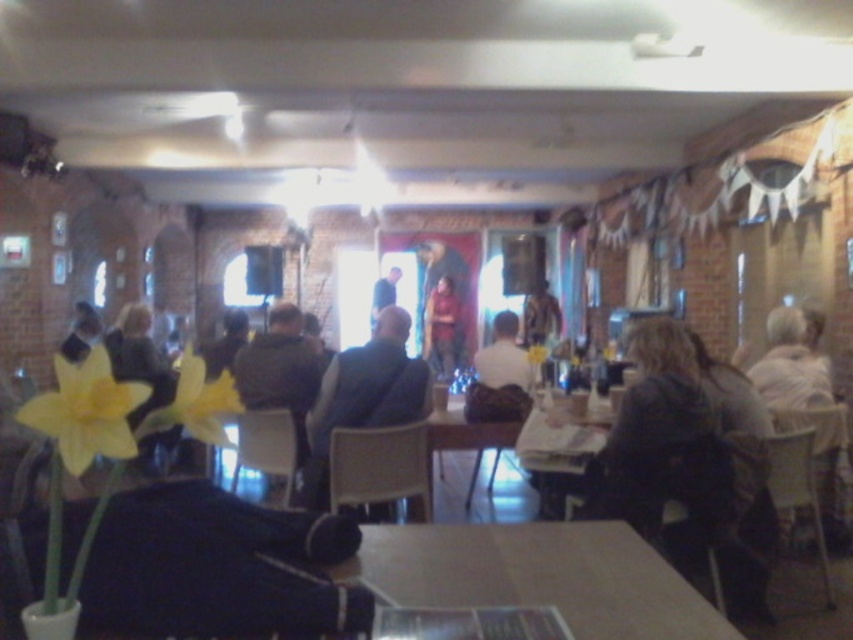
You are planning to place a new decorative item on the table where the yellow matte flower at lower left and the matte red shirt at center are located. Considering their current sizes, which object would allow more space for the new item?

The yellow matte flower at lower left occupies less space than the matte red shirt at center, so placing the new item near the yellow matte flower at lower left would leave more space available.

You are standing in the community hall and want to reach the matte red shirt at center without stepping on the yellow matte flower at lower left. Is this possible?

The yellow matte flower at lower left is closer to the viewer than the matte red shirt at center, so you can walk around it to reach the matte red shirt at center without stepping on the flower.

Looking at this image, you are organizing a coat check for an event and have a small hook that can only hold items up to 20 inches wide. You need to hang both the dark blue vest at center and the dark brown leather jacket at center. Which item is more likely to fit on the hook based on their widths?

The dark brown leather jacket at center is more likely to fit on the hook since its width is smaller than the dark blue vest at center, which is wider and may exceed the 20 inches limit.